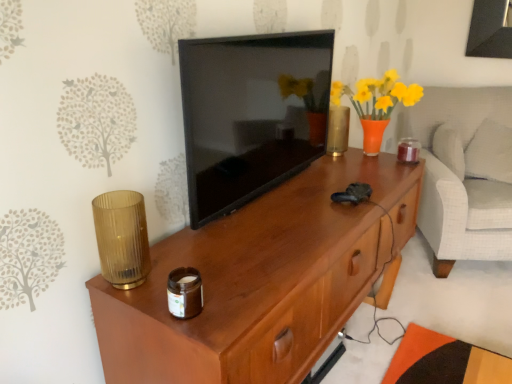
The width and height of the screenshot is (512, 384). Find the location of `free space to the left of brown glass jar at lower center, which is the 1th candle holder from front to back`. free space to the left of brown glass jar at lower center, which is the 1th candle holder from front to back is located at coordinates (141, 296).